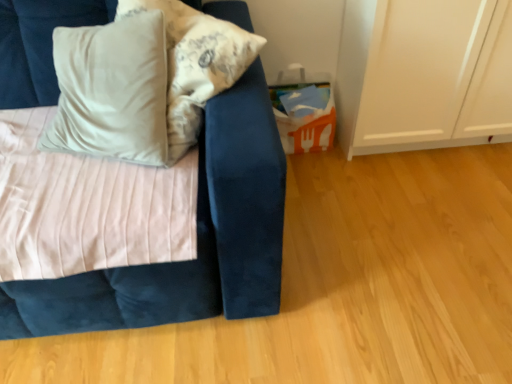
What is the approximate width of velvet blue couch at left?

The width of velvet blue couch at left is 39.14 inches.

Measure the distance between point (121, 286) and camera.

A distance of 3.41 feet exists between point (121, 286) and camera.

Describe the element at coordinates (198, 240) in the screenshot. I see `velvet blue couch at left` at that location.

Locate an element on the screen. velvet blue couch at left is located at coordinates (198, 240).

Find the location of `velvet blue couch at left`. velvet blue couch at left is located at coordinates (198, 240).